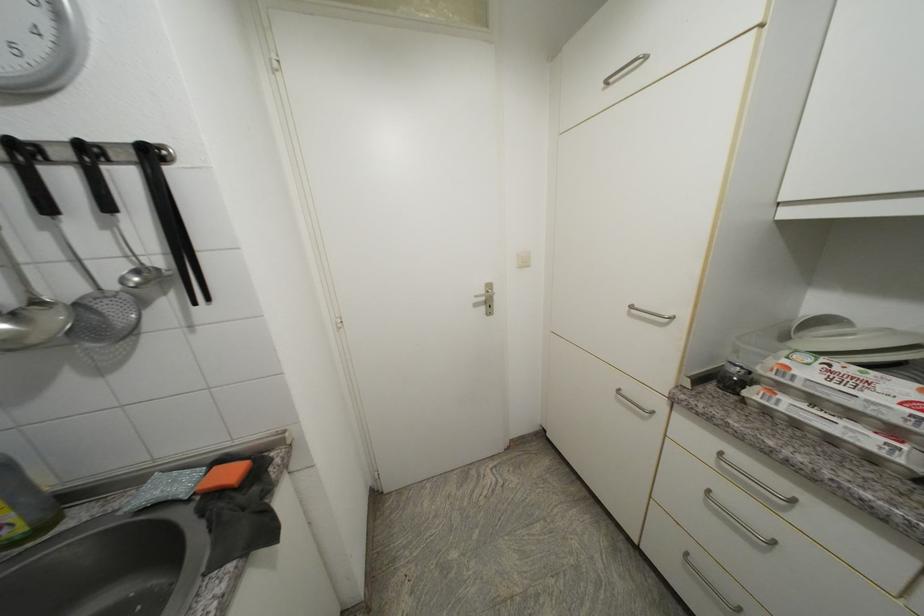
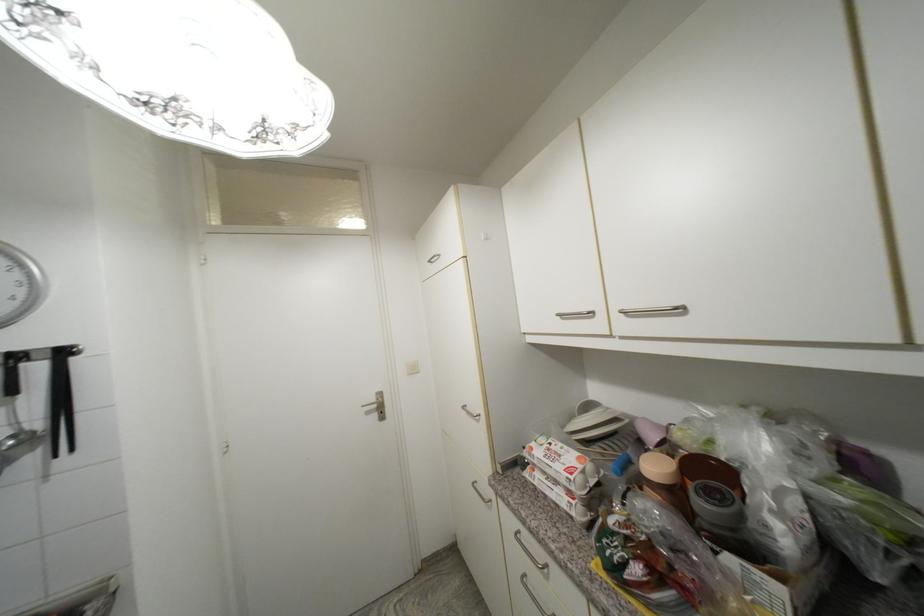
In the second image, find the point that corresponds to point 795,370 in the first image.

(537, 451)